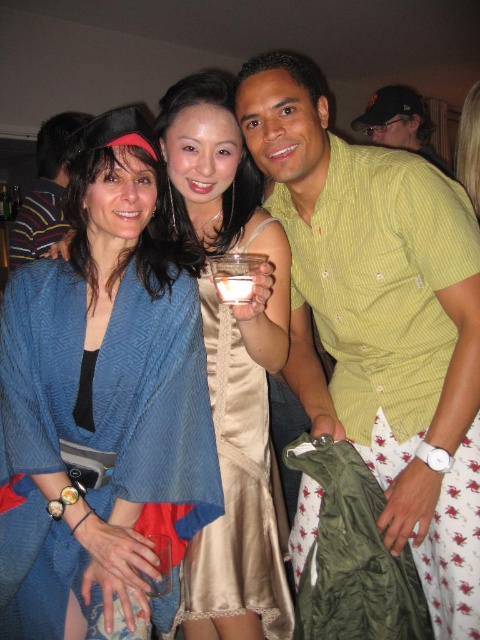
You are at a party and want to grab a drink from the table where the blue silk kimono at left and the clear plastic cup at center are located. Can you tell me which item is higher so I can reach it first?

The blue silk kimono at left is taller than the clear plastic cup at center, so you should reach for the blue silk kimono at left first.

In the scene, where is the blue silk kimono at left located in terms of its 2D coordinates?

The blue silk kimono at left is located at the 2D coordinates point (x=232, y=365).

You are at a party and want to take a photo with both the green striped shirt at center and the blue cotton robe at left. Since the camera can only focus on objects of a certain height, which one should you position closer to the camera to ensure both are in focus?

The green striped shirt at center is taller than the blue cotton robe at left, so you should position the green striped shirt at center closer to the camera to ensure both are within the focus range.